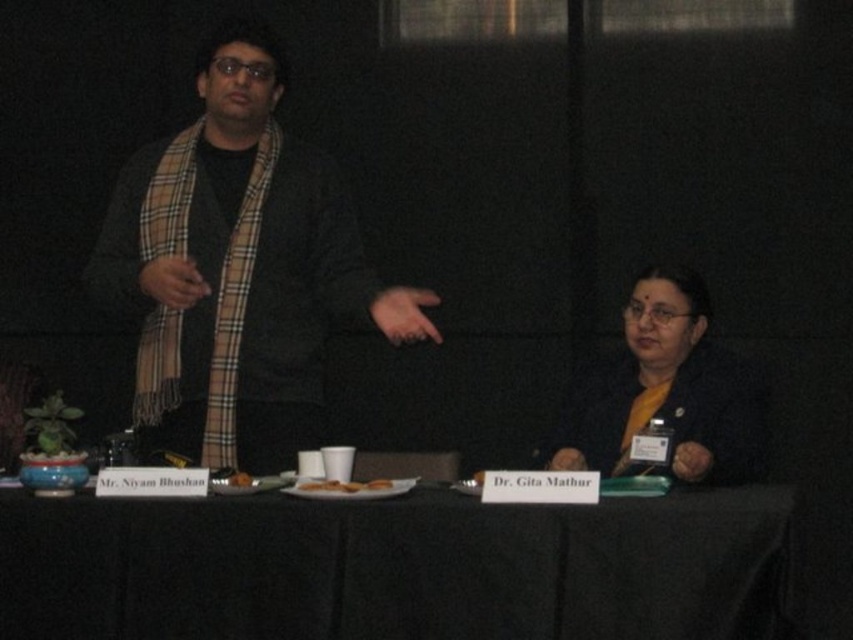
Question: Is the position of yellow matte shirt at lower right more distant than that of brown matte bread at center?

Choices:
 (A) no
 (B) yes

Answer: (B)

Question: Which of the following is the farthest from the observer?

Choices:
 (A) black fabric table at lower center
 (B) brown matte bread at center

Answer: (B)

Question: Among these points, which one is nearest to the camera?

Choices:
 (A) (717, 467)
 (B) (329, 492)
 (C) (190, 205)

Answer: (B)

Question: Does brown matte bread at center come behind brown crumbly cookie at center?

Choices:
 (A) yes
 (B) no

Answer: (B)

Question: Is the position of black fabric table at lower center more distant than that of brown crumbly cookie at center?

Choices:
 (A) no
 (B) yes

Answer: (A)

Question: Which object is positioned farthest from the yellow matte shirt at lower right?

Choices:
 (A) brown crumbly cookie at center
 (B) brown matte bread at center
 (C) black fabric table at lower center

Answer: (A)